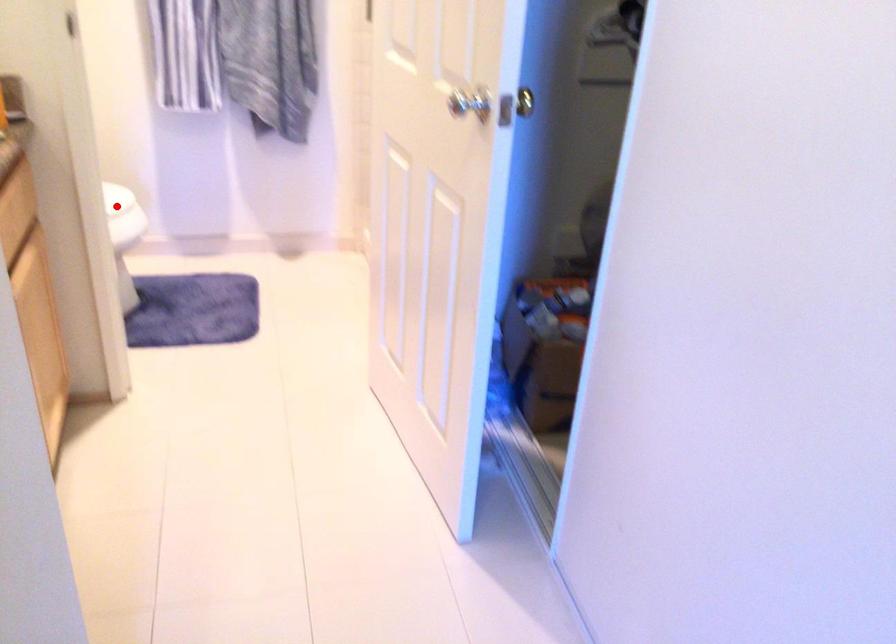
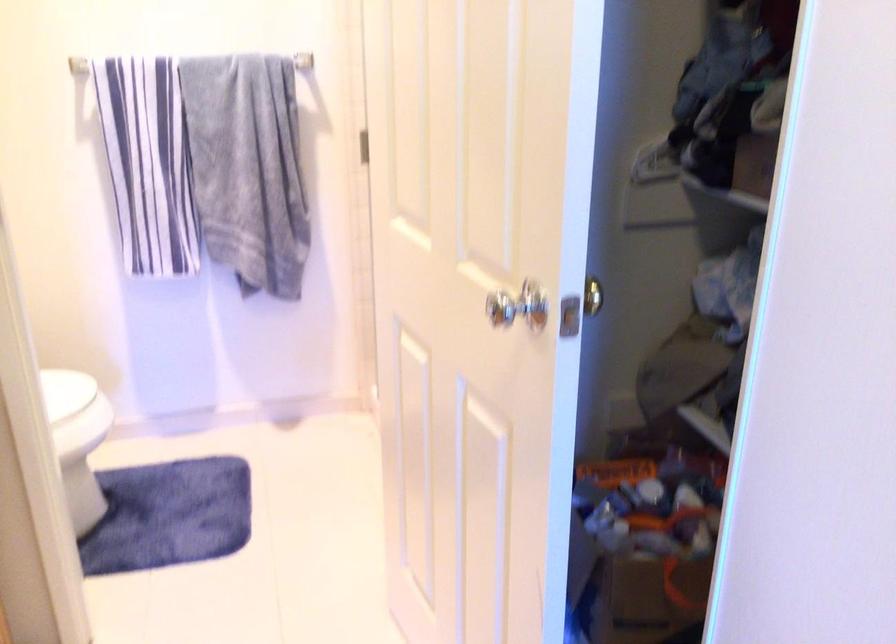
Locate, in the second image, the point that corresponds to the highlighted location in the first image.

(72, 400)